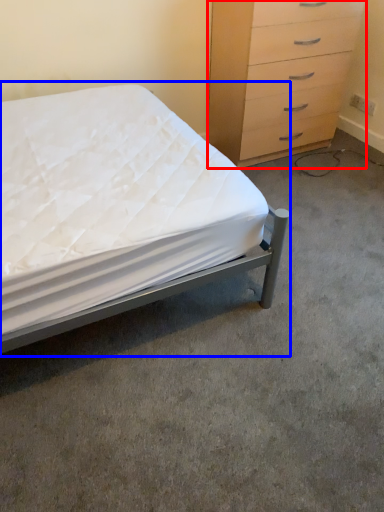
Question: Which object is closer to the camera taking this photo, chest of drawers (highlighted by a red box) or bed (highlighted by a blue box)?

Choices:
 (A) chest of drawers
 (B) bed

Answer: (B)